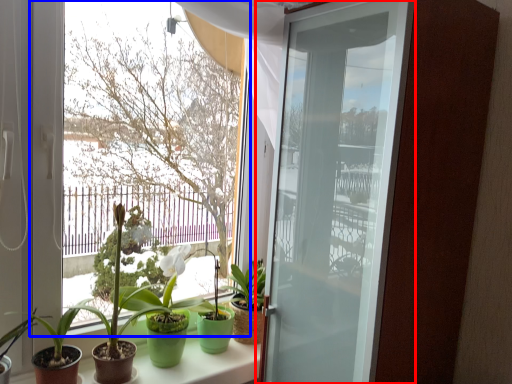
Question: Which object is closer to the camera taking this photo, door (highlighted by a red box) or window (highlighted by a blue box)?

Choices:
 (A) door
 (B) window

Answer: (A)